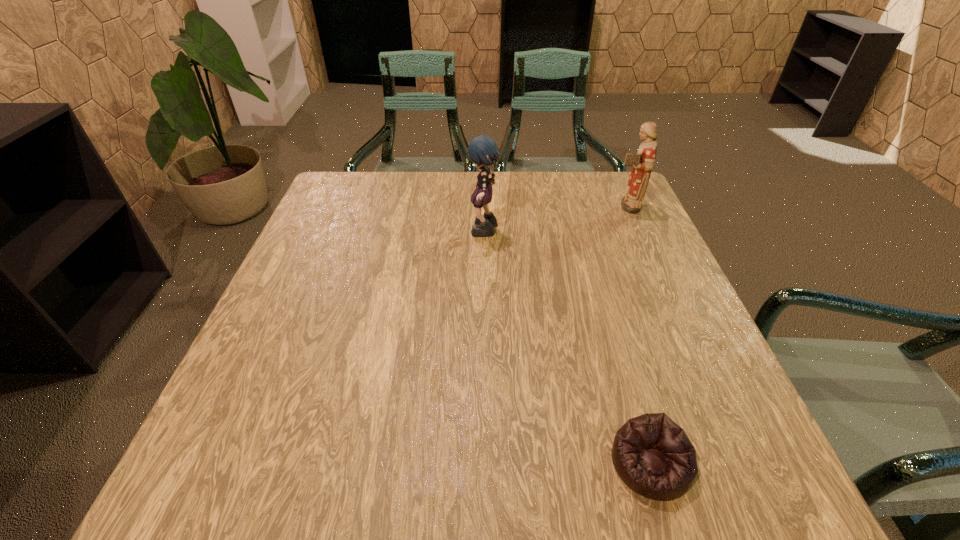
Identify the location of free space at the near edge of the desktop. This screenshot has height=540, width=960. (432, 490).

In the image, there is a desktop. Find the location of `vacant space at the left edge`. vacant space at the left edge is located at coordinates (330, 274).

In order to click on free region at the right edge of the desktop in this screenshot , I will do `click(668, 389)`.

You are a GUI agent. You are given a task and a screenshot of the screen. Output one action in this format:
    pyautogui.click(x=<x>, y=<y>)
    Task: Click on the blank space at the far right corner of the desktop
    Image resolution: width=960 pixels, height=540 pixels.
    Given the screenshot: What is the action you would take?
    pyautogui.click(x=586, y=192)

Identify the location of vacant space that's between the figurine and the rag doll. (555, 219).

Locate an element on the screen. This screenshot has height=540, width=960. vacant area that lies between the leftmost object and the second object from left to right is located at coordinates (567, 348).

Find the location of a particular element. vacant area that lies between the beanbag and the farthest object is located at coordinates (637, 335).

Where is `blank region between the leftmost object and the farthest object`? The width and height of the screenshot is (960, 540). blank region between the leftmost object and the farthest object is located at coordinates (555, 219).

I want to click on blank region between the beanbag and the rag doll, so click(567, 348).

Locate an element on the screen. This screenshot has width=960, height=540. free space between the figurine and the nearest object is located at coordinates (637, 335).